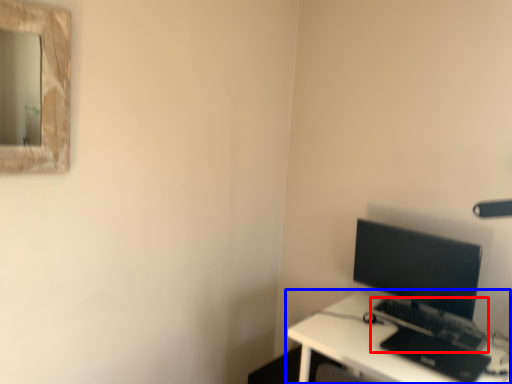
Question: Which of the following is the farthest to the observer, computer keyboard (highlighted by a red box) or desk (highlighted by a blue box)?

Choices:
 (A) computer keyboard
 (B) desk

Answer: (A)